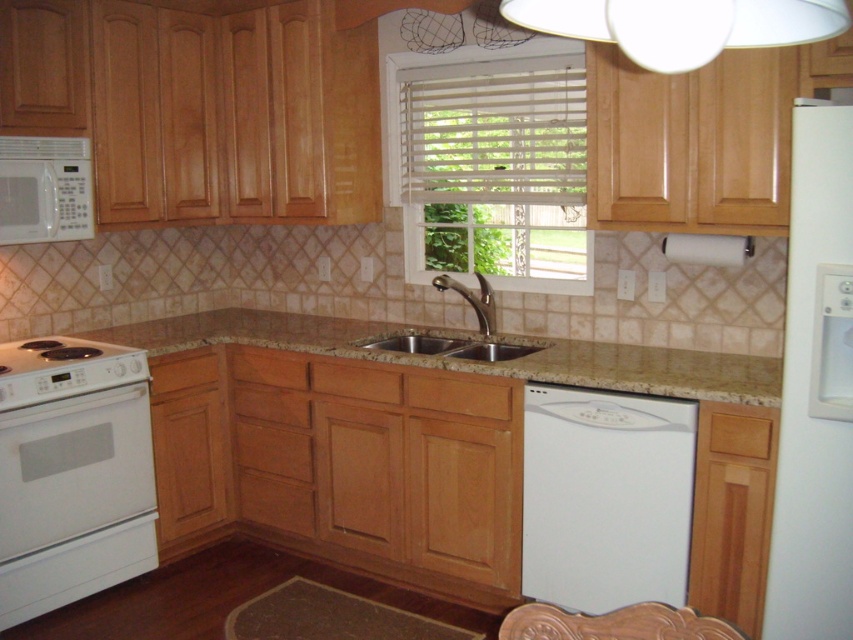
Question: Can you confirm if beige granite countertop at center is positioned above stainless steel sink at center?

Choices:
 (A) no
 (B) yes

Answer: (A)

Question: Which point appears closest to the camera in this image?

Choices:
 (A) (813, 36)
 (B) (76, 564)
 (C) (595, 608)
 (D) (805, 500)

Answer: (A)

Question: Can you confirm if white matte dishwasher at lower center is thinner than stainless steel sink at center?

Choices:
 (A) yes
 (B) no

Answer: (A)

Question: Which point is closer to the camera taking this photo?

Choices:
 (A) (833, 22)
 (B) (372, 352)
 (C) (819, 321)

Answer: (A)

Question: Does white plastic refrigerator at right appear over beige granite countertop at center?

Choices:
 (A) yes
 (B) no

Answer: (B)

Question: Estimate the real-world distances between objects in this image. Which object is closer to the white matte dishwasher at lower center?

Choices:
 (A) white glossy electric stove at lower left
 (B) beige granite countertop at center
 (C) white glossy oven at lower left
 (D) white plastic refrigerator at right

Answer: (D)